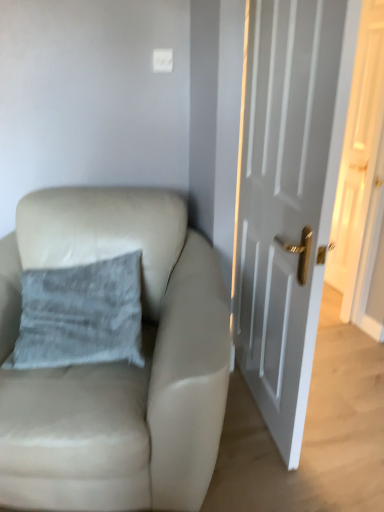
Question: Can you confirm if white glossy door at right, the second door from the back, is shorter than beige leather chair at left?

Choices:
 (A) yes
 (B) no

Answer: (B)

Question: Is white glossy door at right, the second door from the back, at the right side of beige leather chair at left?

Choices:
 (A) yes
 (B) no

Answer: (A)

Question: Does white glossy door at right, the second door from the back, have a greater width compared to beige leather chair at left?

Choices:
 (A) yes
 (B) no

Answer: (B)

Question: Considering the relative positions of white glossy door at right, positioned as the first door in front-to-back order, and beige leather chair at left in the image provided, is white glossy door at right, positioned as the first door in front-to-back order, in front of beige leather chair at left?

Choices:
 (A) yes
 (B) no

Answer: (A)

Question: Considering the relative sizes of white glossy door at right, which appears as the 1th door when viewed from the left, and beige leather chair at left in the image provided, is white glossy door at right, which appears as the 1th door when viewed from the left, smaller than beige leather chair at left?

Choices:
 (A) no
 (B) yes

Answer: (B)

Question: Is beige leather chair at left in front of or behind gray fabric pillow at upper left in the image?

Choices:
 (A) front
 (B) behind

Answer: (A)

Question: Would you say beige leather chair at left is to the left or to the right of gray fabric pillow at upper left in the picture?

Choices:
 (A) right
 (B) left

Answer: (A)

Question: From the image's perspective, is beige leather chair at left positioned above or below gray fabric pillow at upper left?

Choices:
 (A) above
 (B) below

Answer: (B)

Question: Does point (190, 344) appear closer or farther from the camera than point (122, 258)?

Choices:
 (A) farther
 (B) closer

Answer: (B)

Question: Is white glossy door at right, which is the 1th door in right-to-left order, bigger or smaller than white glossy door at right, which appears as the 1th door when viewed from the left?

Choices:
 (A) big
 (B) small

Answer: (B)

Question: Do you think white glossy door at right, which is the 1th door in right-to-left order, is within white glossy door at right, the second door from the back, or outside of it?

Choices:
 (A) outside
 (B) inside

Answer: (A)

Question: From a real-world perspective, is white glossy door at right, which is the 1th door in right-to-left order, above or below white glossy door at right, the second door in the right-to-left sequence?

Choices:
 (A) above
 (B) below

Answer: (A)

Question: From their relative heights in the image, would you say white glossy door at right, the 2th door from the left, is taller or shorter than white glossy door at right, the second door in the right-to-left sequence?

Choices:
 (A) tall
 (B) short

Answer: (A)

Question: From a real-world perspective, is white glossy door at right, which appears as the 1th door when viewed from the left, physically located above or below beige leather chair at left?

Choices:
 (A) below
 (B) above

Answer: (B)

Question: Considering the positions of point (271, 174) and point (3, 492), is point (271, 174) closer or farther from the camera than point (3, 492)?

Choices:
 (A) farther
 (B) closer

Answer: (A)